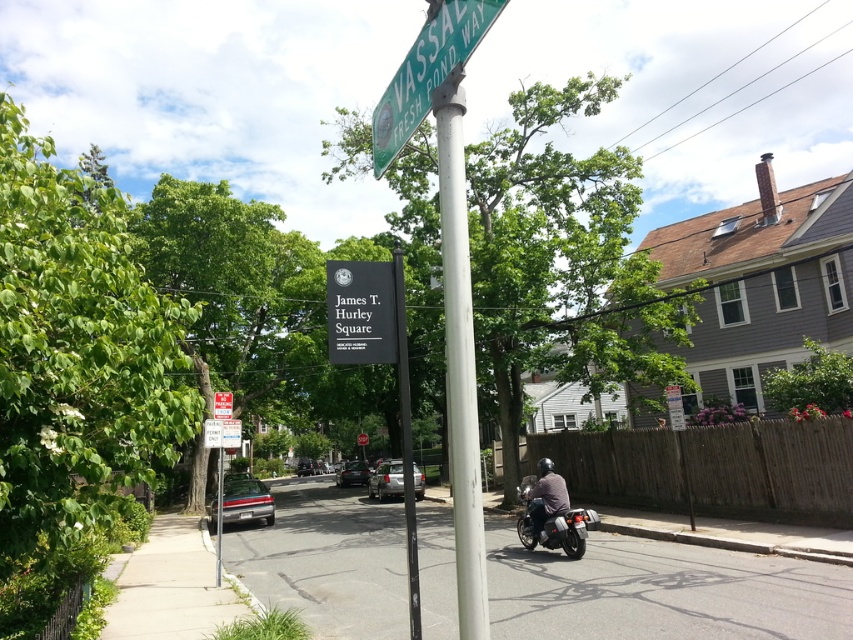
Is gray asphalt road at center wider than green plastic street sign at upper center?

Correct, the width of gray asphalt road at center exceeds that of green plastic street sign at upper center.

Is gray asphalt road at center above green plastic street sign at upper center?

No.

Measure the distance between gray asphalt road at center and camera.

gray asphalt road at center and camera are 6.15 meters apart from each other.

Locate an element on the screen. This screenshot has height=640, width=853. gray asphalt road at center is located at coordinates (659, 592).

Which is in front, point (540, 460) or point (219, 577)?

Positioned in front is point (219, 577).

Which is below, dark gray leather jacket at lower center or metallic pole at center?

metallic pole at center

Which is in front, point (541, 509) or point (218, 476)?

Point (541, 509)

Image resolution: width=853 pixels, height=640 pixels. What are the coordinates of `dark gray leather jacket at lower center` in the screenshot? It's located at (546, 497).

Is gray asphalt road at center smaller than dark gray leather jacket at lower center?

Incorrect, gray asphalt road at center is not smaller in size than dark gray leather jacket at lower center.

Between gray asphalt road at center and dark gray leather jacket at lower center, which one is positioned lower?

Positioned lower is gray asphalt road at center.

At what (x,y) coordinates should I click in order to perform the action: click on gray asphalt road at center. Please return your answer as a coordinate pair (x, y). Image resolution: width=853 pixels, height=640 pixels. Looking at the image, I should click on (659, 592).